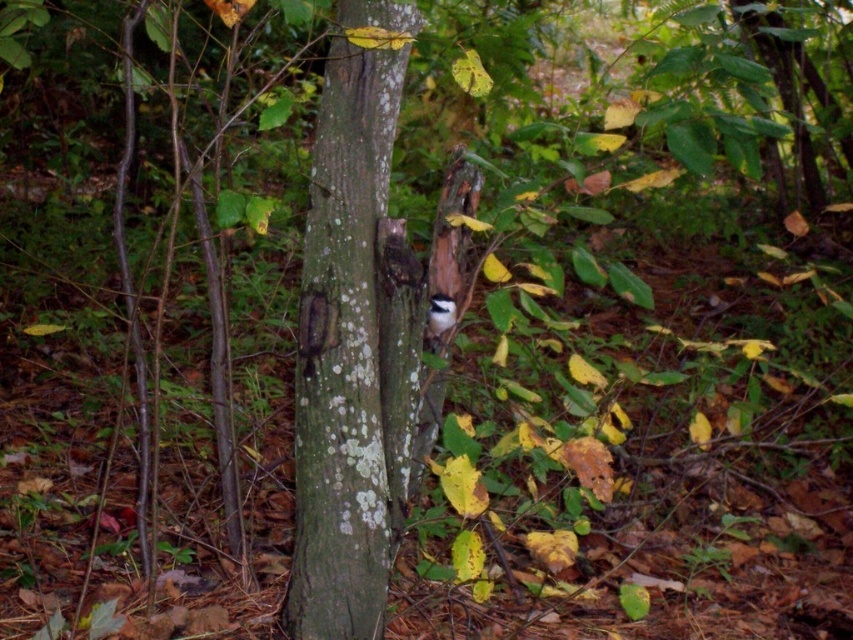
Describe the element at coordinates (343, 356) in the screenshot. I see `green rough bark tree trunk at center` at that location.

Locate an element on the screen. This screenshot has width=853, height=640. green rough bark tree trunk at center is located at coordinates (343, 356).